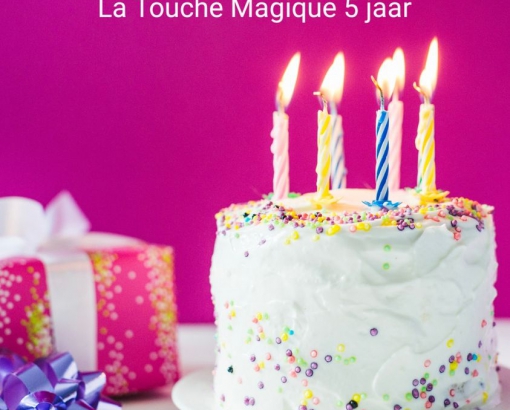
This screenshot has height=410, width=510. I want to click on candle wicks, so click(x=279, y=103), click(x=322, y=102), click(x=333, y=104), click(x=380, y=90), click(x=417, y=88), click(x=397, y=89).